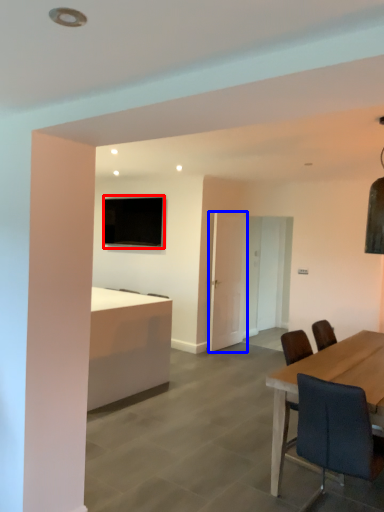
Question: Among these objects, which one is farthest to the camera, television (highlighted by a red box) or glass door (highlighted by a blue box)?

Choices:
 (A) television
 (B) glass door

Answer: (A)